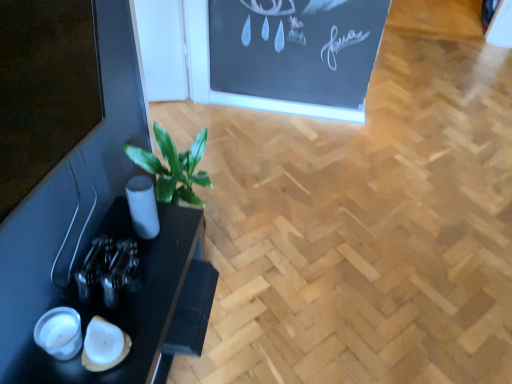
Question: Can you confirm if metallic glass bottle at left is bigger than black glossy table at lower left?

Choices:
 (A) yes
 (B) no

Answer: (B)

Question: Is metallic glass bottle at left not inside black glossy table at lower left?

Choices:
 (A) no
 (B) yes

Answer: (B)

Question: From the image's perspective, would you say metallic glass bottle at left is shown under black glossy table at lower left?

Choices:
 (A) no
 (B) yes

Answer: (A)

Question: Does metallic glass bottle at left contain black glossy table at lower left?

Choices:
 (A) no
 (B) yes

Answer: (A)

Question: Considering the relative positions of metallic glass bottle at left and black glossy table at lower left in the image provided, is metallic glass bottle at left behind black glossy table at lower left?

Choices:
 (A) yes
 (B) no

Answer: (A)

Question: From the image's perspective, is metallic glass bottle at left on top of black glossy table at lower left?

Choices:
 (A) no
 (B) yes

Answer: (B)

Question: Does black glossy table at lower left have a lesser height compared to metallic glass bottle at left?

Choices:
 (A) no
 (B) yes

Answer: (A)

Question: Is black glossy table at lower left closer to camera compared to metallic glass bottle at left?

Choices:
 (A) no
 (B) yes

Answer: (B)

Question: Is metallic glass bottle at left at the back of black glossy table at lower left?

Choices:
 (A) yes
 (B) no

Answer: (B)

Question: From a real-world perspective, is black glossy table at lower left under metallic glass bottle at left?

Choices:
 (A) no
 (B) yes

Answer: (B)

Question: From a real-world perspective, is black glossy table at lower left physically above metallic glass bottle at left?

Choices:
 (A) yes
 (B) no

Answer: (B)

Question: From the image's perspective, is black glossy table at lower left above metallic glass bottle at left?

Choices:
 (A) no
 (B) yes

Answer: (A)

Question: From the image's perspective, is black glossy table at lower left located above or below metallic glass bottle at left?

Choices:
 (A) above
 (B) below

Answer: (B)